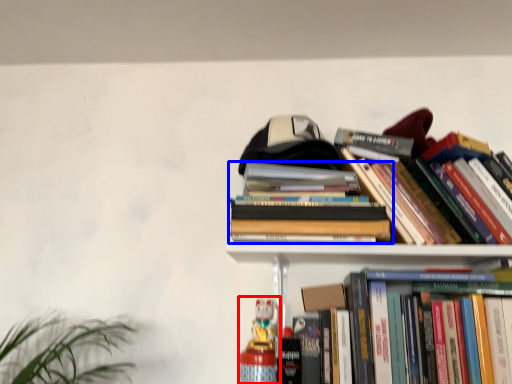
Question: Which object appears closest to the camera in this image, toy (highlighted by a red box) or book (highlighted by a blue box)?

Choices:
 (A) toy
 (B) book

Answer: (B)